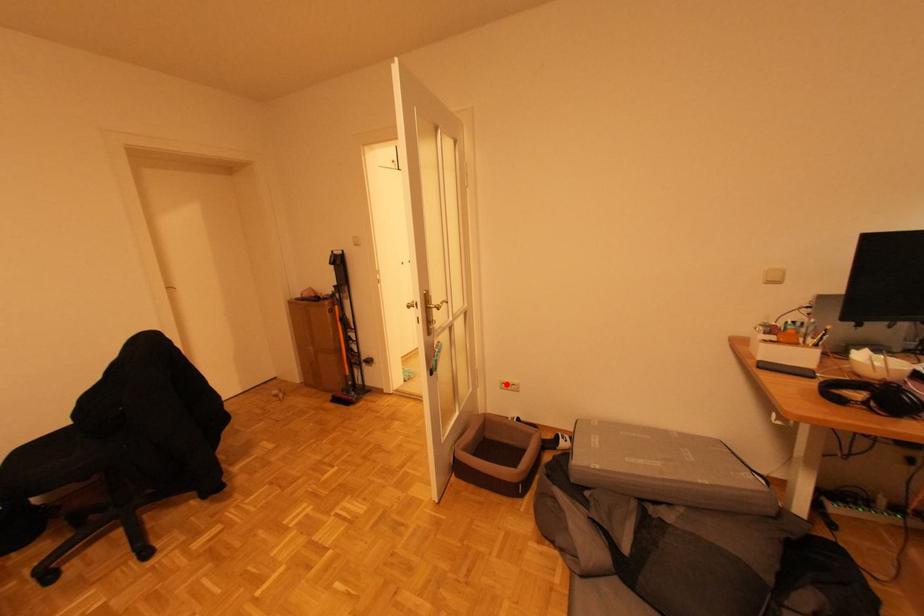
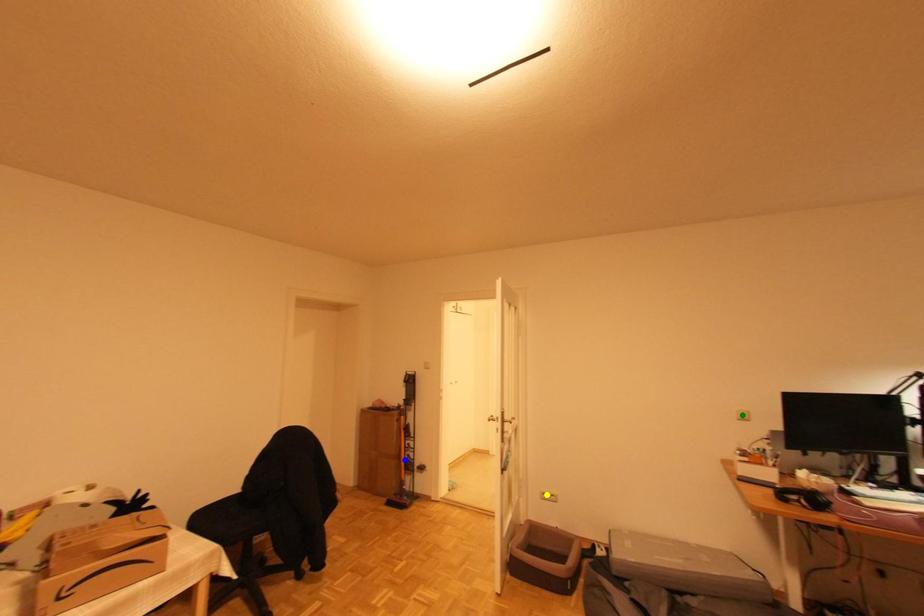
Question: I am providing you with two images of the same scene from different viewpoints. A red point is marked on the first image. You are given multiple points on the second image. Which spot in image 2 lines up with the point in image 1?

Choices:
 (A) yellow point
 (B) blue point
 (C) green point

Answer: (A)